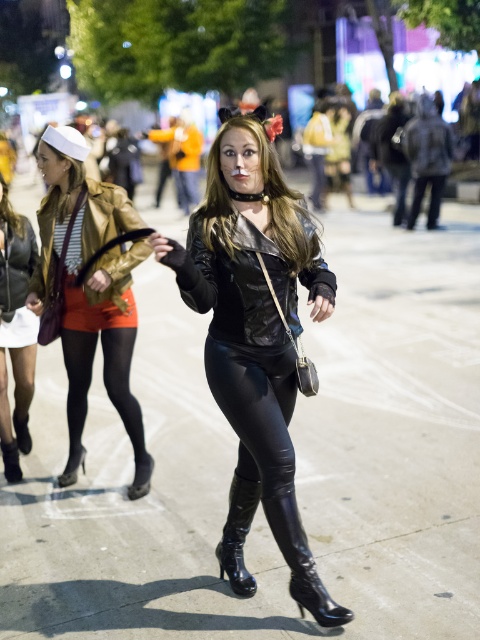
Is point (178, 371) farther from camera compared to point (324, 598)?

Yes, point (178, 371) is behind point (324, 598).

Which is above, black leather pants at center or glossy patent leather boot at center?

Positioned higher is black leather pants at center.

The height and width of the screenshot is (640, 480). What are the coordinates of `black leather pants at center` in the screenshot? It's located at (296, 468).

Which is above, black leather pants at center or shiny black leather cat suit at center?

shiny black leather cat suit at center

Does black leather pants at center have a larger size compared to shiny black leather cat suit at center?

Correct, black leather pants at center is larger in size than shiny black leather cat suit at center.

Does point (180, 369) come in front of point (307, 250)?

No, it is not.

Where is `black leather pants at center`? Image resolution: width=480 pixels, height=640 pixels. black leather pants at center is located at coordinates coord(296,468).

Does shiny black leather outfit at center come behind shiny gold jacket at left?

That is False.

Is point (277, 369) farther from viewer compared to point (63, 138)?

No.

Between point (262, 285) and point (70, 275), which one is positioned behind?

Point (70, 275)

Where is `shiny black leather outfit at center`? shiny black leather outfit at center is located at coordinates (254, 337).